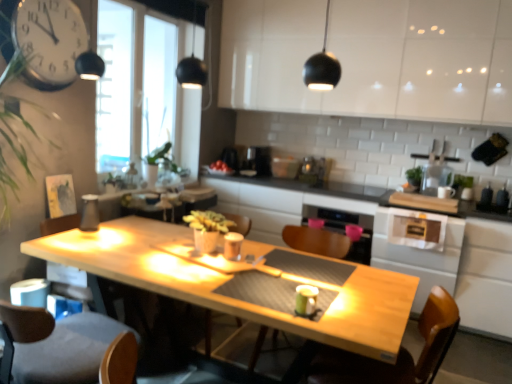
Question: Is wooden table at center at the right side of metallic silver clock at upper left?

Choices:
 (A) no
 (B) yes

Answer: (B)

Question: Is wooden table at center surrounding metallic silver clock at upper left?

Choices:
 (A) yes
 (B) no

Answer: (B)

Question: Is wooden table at center far away from metallic silver clock at upper left?

Choices:
 (A) no
 (B) yes

Answer: (B)

Question: Is wooden table at center taller than metallic silver clock at upper left?

Choices:
 (A) yes
 (B) no

Answer: (A)

Question: From the image's perspective, would you say wooden table at center is shown under metallic silver clock at upper left?

Choices:
 (A) yes
 (B) no

Answer: (A)

Question: Does wooden table at center have a larger size compared to metallic silver clock at upper left?

Choices:
 (A) no
 (B) yes

Answer: (B)

Question: From the image's perspective, does satin silver toaster at center, placed as the third appliance when sorted from left to right, appear lower than metallic silver toaster at upper center, acting as the 1th appliance starting from the top?

Choices:
 (A) no
 (B) yes

Answer: (B)

Question: Does satin silver toaster at center, the 2th appliance when ordered from bottom to top, have a greater height compared to metallic silver toaster at upper center, which is counted as the 2th appliance, starting from the right?

Choices:
 (A) no
 (B) yes

Answer: (A)

Question: Does satin silver toaster at center, positioned as the 2th appliance in front-to-back order, appear on the left side of metallic silver toaster at upper center, the third appliance viewed from the front?

Choices:
 (A) no
 (B) yes

Answer: (A)

Question: Is satin silver toaster at center, the 2th appliance from the back, far away from metallic silver toaster at upper center, acting as the 1th appliance starting from the top?

Choices:
 (A) yes
 (B) no

Answer: (B)

Question: Is satin silver toaster at center, the 2th appliance when ordered from bottom to top, turned away from metallic silver toaster at upper center, acting as the 1th appliance starting from the top?

Choices:
 (A) no
 (B) yes

Answer: (A)

Question: From a real-world perspective, is satin silver toaster at center, positioned as the 2th appliance in front-to-back order, located beneath metallic silver toaster at upper center, positioned as the 3th appliance in bottom-to-top order?

Choices:
 (A) no
 (B) yes

Answer: (B)

Question: Is matte glass carafe at left, the first appliance in the left-to-right sequence, bigger than metallic silver clock at upper left?

Choices:
 (A) yes
 (B) no

Answer: (B)